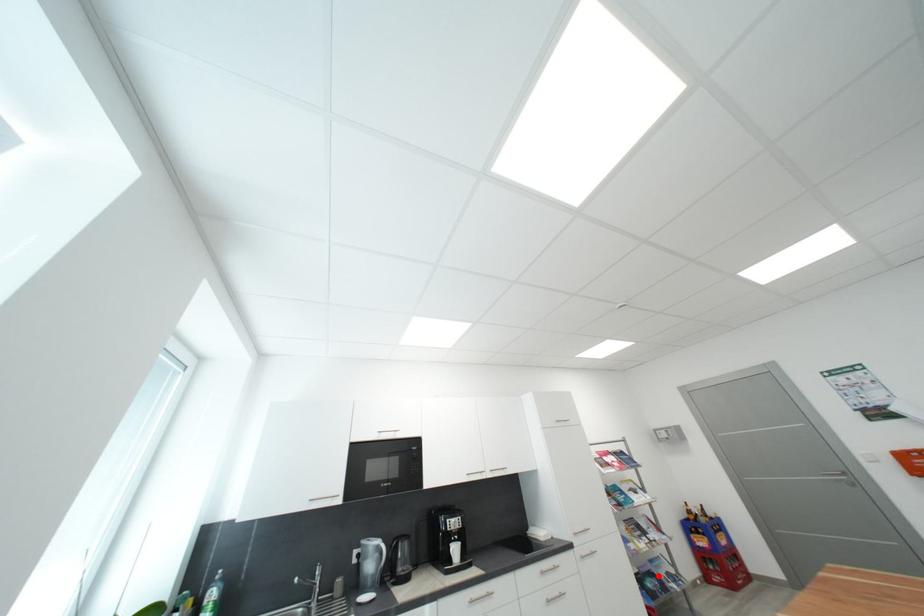
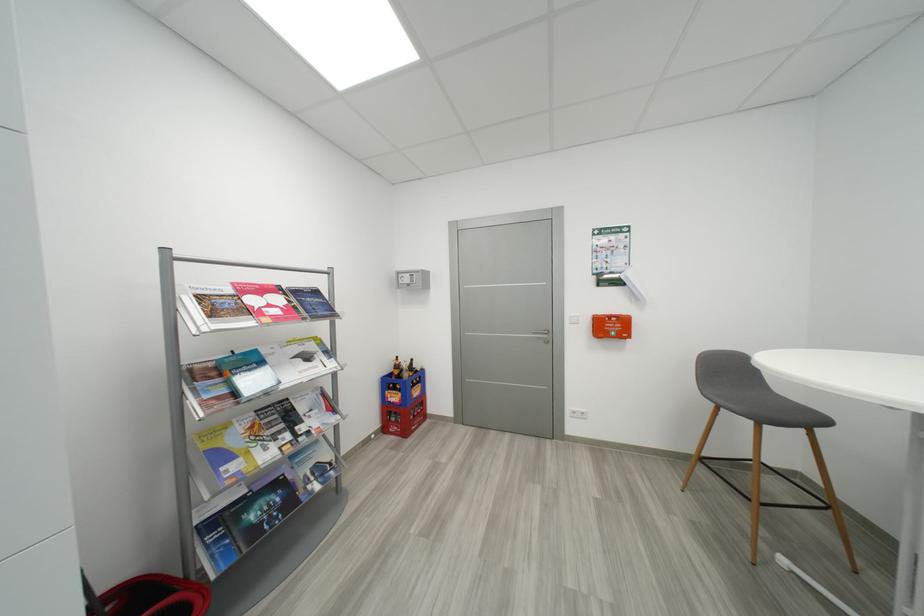
Question: I am providing you with two images of the same scene from different viewpoints. A red point is shown in image1. For the corresponding object point in image2, is it positioned nearer or farther from the camera?

Choices:
 (A) Nearer
 (B) Farther

Answer: (B)